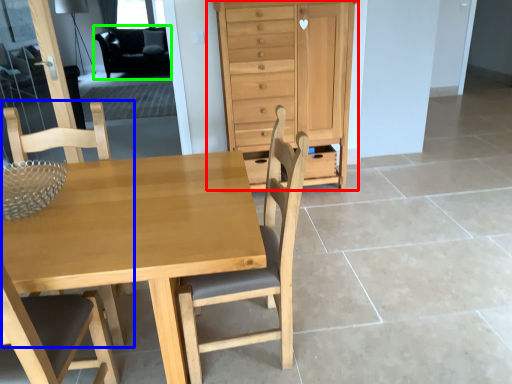
Question: Which is nearer to the chest of drawers (highlighted by a red box)? chair (highlighted by a blue box) or armchair (highlighted by a green box).

Choices:
 (A) chair
 (B) armchair

Answer: (A)